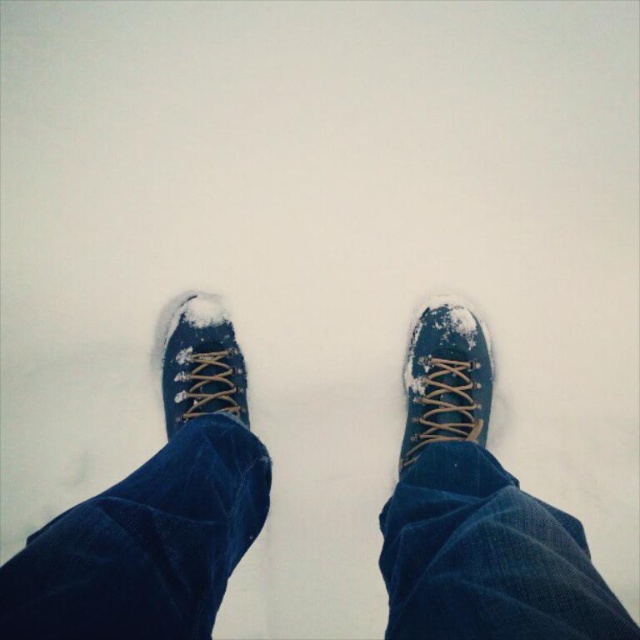
You are a photographer trying to capture the reflection of the snow on the blue canvas shoes at center and blue canvas shoe at center. Given that the optimal reflection distance is 6 inches, will you need to adjust the camera position?

The distance between the blue canvas shoes at center and blue canvas shoe at center is 7.02 inches, which exceeds the optimal reflection distance of 6 inches. Therefore, you should move the camera closer to reduce the distance between them for better reflection.

You are trying to determine which of the two shoes is closer to you. Looking at the blue canvas shoes at center and the blue suede shoe at center, which one appears nearer?

The blue canvas shoes at center appears nearer because it is closer to the viewer than the blue suede shoe at center.

You are standing in the snow and see two points marked on the ground. One is at point (440, 330) and the other at point (224, 394). Which point is closer to you?

Point (440, 330) is further to the viewer than point (224, 394), so the point closer to you is point (224, 394).